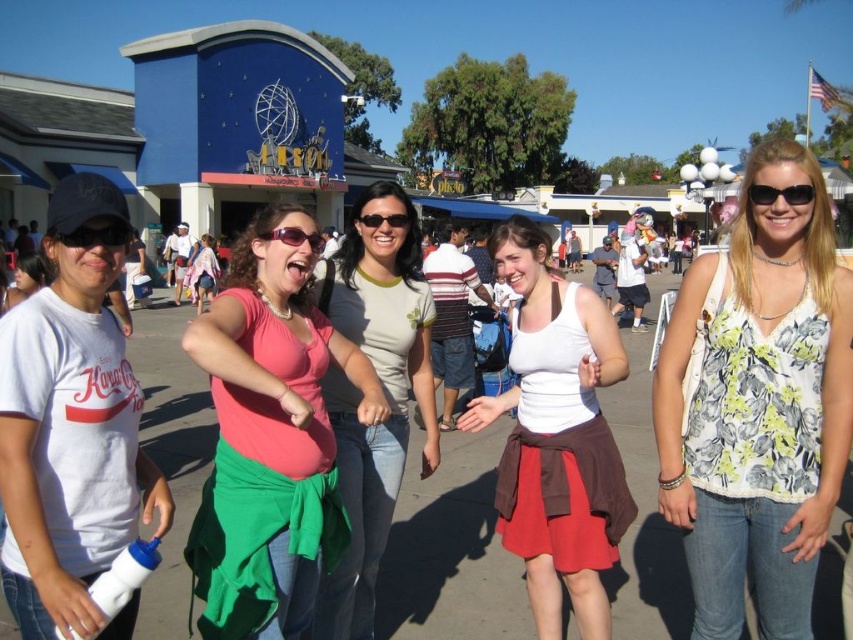
From the picture: You are a photographer standing at the center of the scene. You want to take a photo of the black plastic goggles at left and another object that is 20.63 meters away from them. Which object in the scene is exactly that distance away?

The black plastic goggles at left are 20.63 meters apart from the other object, but since there is only one object listed in the Objects section, which is the black plastic goggles at left, there isn t enough information to determine which specific object is 20.63 meters away. Please provide more details about other objects in the scene.

You are a photographer at the theme park and want to capture a photo that includes both the black plastic goggles at left and the sunglasses at upper right. Which object should you focus on first if you want to ensure both are in the frame?

You should focus on the sunglasses at upper right first because the black plastic goggles at left is located below it, so by centering the sunglasses at upper right, the goggles will naturally fall into the lower part of the frame.

You are a photographer trying to capture a clear shot of the black plastic goggles at left and the sunglasses at upper right. Which object should you focus on first if you want to ensure both are in focus without adjusting your camera settings?

The black plastic goggles at left is taller than sunglasses at upper right, so focusing on the black plastic goggles at left first will ensure both are in focus since it is larger and requires more precise focus.